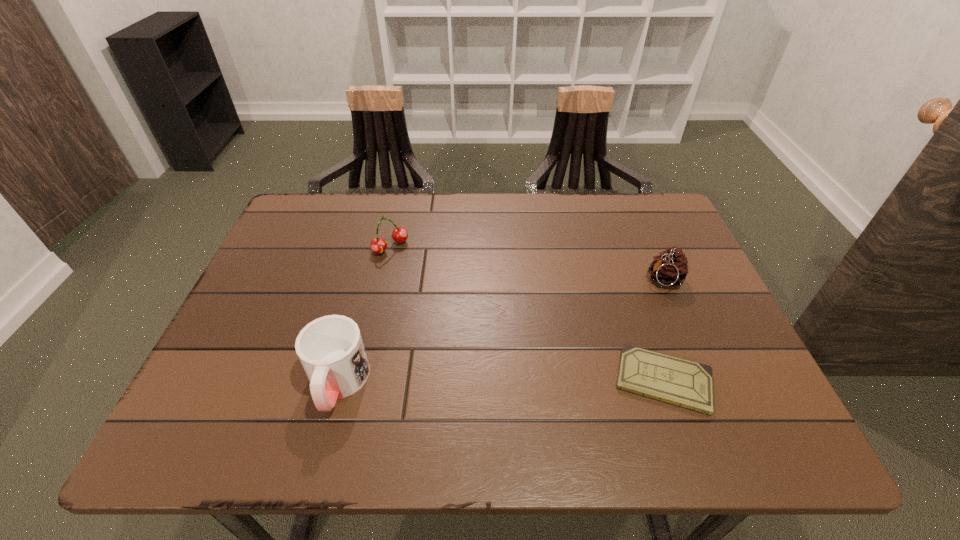
You are a GUI agent. You are given a task and a screenshot of the screen. Output one action in this format:
    pyautogui.click(x=<x>, y=<y>)
    Task: Click on the free space between the pinecone and the checkbook
    
    Given the screenshot: What is the action you would take?
    pyautogui.click(x=664, y=330)

Locate an element on the screen. This screenshot has width=960, height=540. free space between the checkbook and the cherry is located at coordinates (527, 313).

Image resolution: width=960 pixels, height=540 pixels. Identify the location of free area in between the cherry and the mug. (365, 315).

Select which object is the second closest to the shortest object. Please provide its 2D coordinates. Your answer should be formatted as a tuple, i.e. [(x, y)], where the tuple contains the x and y coordinates of a point satisfying the conditions above.

[(330, 349)]

Find the location of a particular element. Image resolution: width=960 pixels, height=540 pixels. object identified as the third closest to the mug is located at coordinates (670, 268).

This screenshot has height=540, width=960. What are the coordinates of `blank space that satisfies the following two spatial constraints: 1. on the front side of the farthest object; 2. on the left side of the checkbook` in the screenshot? It's located at (361, 380).